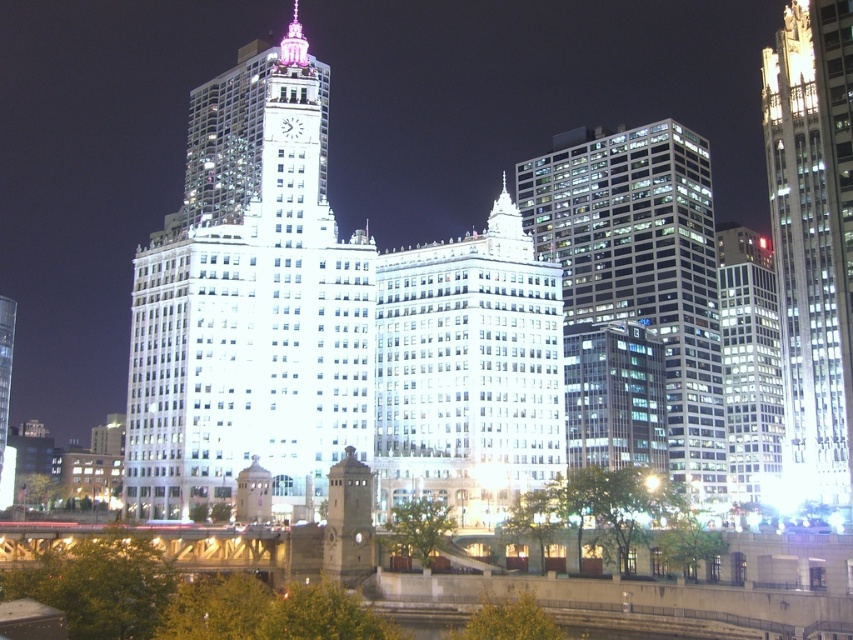
Can you confirm if white glass building at center is positioned to the left of shiny glass skyscraper at right?

Correct, you'll find white glass building at center to the left of shiny glass skyscraper at right.

Is white glass building at center above shiny glass skyscraper at right?

Actually, white glass building at center is below shiny glass skyscraper at right.

Does point (300, 442) come behind point (769, 84)?

No, (300, 442) is closer to viewer.

The height and width of the screenshot is (640, 853). Identify the location of white glass building at center. (250, 304).

Between white glass building at center and matte glass skyscraper at right, which one is positioned higher?

Positioned higher is white glass building at center.

Image resolution: width=853 pixels, height=640 pixels. What do you see at coordinates (250, 304) in the screenshot?
I see `white glass building at center` at bounding box center [250, 304].

The image size is (853, 640). In order to click on white glass building at center in this screenshot , I will do `click(250, 304)`.

Identify the location of shiny glass skyscraper at right. (813, 234).

Can you confirm if shiny glass skyscraper at right is positioned to the right of matte glass skyscraper at right?

Indeed, shiny glass skyscraper at right is positioned on the right side of matte glass skyscraper at right.

Measure the distance between shiny glass skyscraper at right and camera.

shiny glass skyscraper at right is 265.91 feet away from camera.

This screenshot has height=640, width=853. In order to click on shiny glass skyscraper at right in this screenshot , I will do `click(813, 234)`.